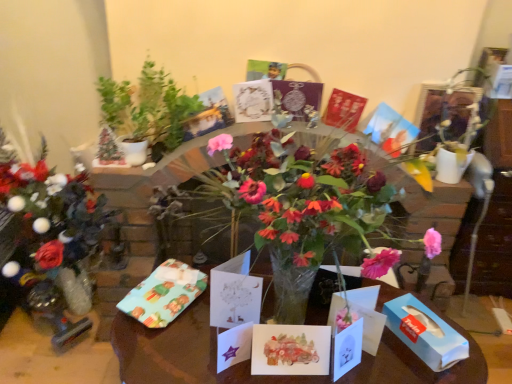
This screenshot has height=384, width=512. I want to click on green leafy plant at upper left, so click(x=148, y=109).

Image resolution: width=512 pixels, height=384 pixels. Describe the element at coordinates (148, 109) in the screenshot. I see `green leafy plant at upper left` at that location.

In order to click on watercolor paper card at center, marked as the 4th birthday card in a back-to-front arrangement in this screenshot , I will do `click(290, 350)`.

What do you see at coordinates (182, 352) in the screenshot?
I see `matte paper cards at center` at bounding box center [182, 352].

Find the location of `blue paper tissue box at lower right`. blue paper tissue box at lower right is located at coordinates (425, 333).

Is white paper card at center, which is the 1th birthday card in front-to-back order, not near matte paper card at center, the 2th birthday card from the back?

No, there isn't a large distance between white paper card at center, which is the 1th birthday card in front-to-back order, and matte paper card at center, the 2th birthday card from the back.

Which is behind, white paper card at center, positioned as the fifth birthday card in back-to-front order, or matte paper card at center, acting as the fourth birthday card starting from the front?

matte paper card at center, acting as the fourth birthday card starting from the front, is more distant.

Can you confirm if white paper card at center, which is the 1th birthday card in front-to-back order, is wider than matte paper card at center, the 3th birthday card when ordered from bottom to top?

In fact, white paper card at center, which is the 1th birthday card in front-to-back order, might be narrower than matte paper card at center, the 3th birthday card when ordered from bottom to top.

How far apart are white paper card at center, which is the 1th birthday card in front-to-back order, and matte paper card at center, the 3th birthday card when ordered from bottom to top?

white paper card at center, which is the 1th birthday card in front-to-back order, and matte paper card at center, the 3th birthday card when ordered from bottom to top, are 21.70 inches apart from each other.

Is blue paper tissue box at lower right to the left or to the right of matte paper card at center, which ranks as the 3th birthday card in top-to-bottom order, in the image?

blue paper tissue box at lower right is positioned on matte paper card at center, which ranks as the 3th birthday card in top-to-bottom order,'s left side.

Could you tell me if blue paper tissue box at lower right is turned towards matte paper card at center, the 2th birthday card from the back?

No, blue paper tissue box at lower right is not turned towards matte paper card at center, the 2th birthday card from the back.

From the image's perspective, which object appears higher, blue paper tissue box at lower right or matte paper card at center, acting as the fourth birthday card starting from the front?

matte paper card at center, acting as the fourth birthday card starting from the front, from the image's perspective.

From a real-world perspective, does blue paper tissue box at lower right sit lower than matte paper card at center, acting as the fourth birthday card starting from the front?

Yes.

Is matte paper cards at center positioned in front of white paper card at center, acting as the first birthday card starting from the top?

Yes, matte paper cards at center is closer to the camera.

Does matte paper cards at center have a smaller size compared to white paper card at center, the third birthday card when ordered from back to front?

Actually, matte paper cards at center might be larger than white paper card at center, the third birthday card when ordered from back to front.

Does point (263, 307) lie in front of point (246, 120)?

Yes, point (263, 307) is closer to viewer.

Considering the sizes of objects matte paper cards at center and white paper card at center, which appears as the 3th birthday card when viewed from the front, in the image provided, who is taller, matte paper cards at center or white paper card at center, which appears as the 3th birthday card when viewed from the front,?

Standing taller between the two is matte paper cards at center.

Looking at the image, does white paper card at center, positioned as the 1th birthday card in bottom-to-top order, seem bigger or smaller compared to green leafy plant at upper left?

In the image, white paper card at center, positioned as the 1th birthday card in bottom-to-top order, appears to be smaller than green leafy plant at upper left.

Which is closer, (351, 348) or (134, 138)?

Point (351, 348) appears to be closer to the viewer than point (134, 138).

From the image's perspective, is white paper card at center, positioned as the fifth birthday card in top-to-bottom order, located above green leafy plant at upper left?

No.

Is white paper card at center, which is the 1th birthday card in front-to-back order, in front of or behind green leafy plant at upper left in the image?

In the image, white paper card at center, which is the 1th birthday card in front-to-back order, appears in front of green leafy plant at upper left.

Is the position of blue paper tissue box at lower right less distant than that of matte paper cards at center?

No.

Considering the sizes of objects blue paper tissue box at lower right and matte paper cards at center in the image provided, who is bigger, blue paper tissue box at lower right or matte paper cards at center?

Bigger between the two is matte paper cards at center.

From the image's perspective, is blue paper tissue box at lower right positioned above or below matte paper cards at center?

blue paper tissue box at lower right is situated higher than matte paper cards at center in the image.

From a real-world perspective, is blue paper tissue box at lower right physically below matte paper cards at center?

Actually, blue paper tissue box at lower right is physically above matte paper cards at center in the real world.

Can you tell me how much green leafy plant at upper left and white paper card at center, acting as the first birthday card starting from the top, differ in facing direction?

The angle between the facing direction of green leafy plant at upper left and the facing direction of white paper card at center, acting as the first birthday card starting from the top, is 7.41 degrees.

From the image's perspective, which is above, green leafy plant at upper left or white paper card at center, the third birthday card when ordered from back to front?

white paper card at center, the third birthday card when ordered from back to front, appears higher in the image.

Is green leafy plant at upper left outside of white paper card at center, placed as the fifth birthday card when sorted from bottom to top?

green leafy plant at upper left is positioned outside white paper card at center, placed as the fifth birthday card when sorted from bottom to top.

From a real-world perspective, is green leafy plant at upper left located higher than white paper card at center, the third birthday card when ordered from back to front?

No, from a real-world perspective, green leafy plant at upper left is not on top of white paper card at center, the third birthday card when ordered from back to front.

Is matte paper card at center, which ranks as the 3th birthday card in top-to-bottom order, positioned far away from matte red card at center, the fifth birthday card viewed from the front?

No, there isn't a large distance between matte paper card at center, which ranks as the 3th birthday card in top-to-bottom order, and matte red card at center, the fifth birthday card viewed from the front.

Considering the positions of point (381, 135) and point (344, 112), is point (381, 135) closer or farther from the camera than point (344, 112)?

Point (381, 135) is positioned closer to the camera compared to point (344, 112).

Does matte paper card at center, acting as the fourth birthday card starting from the front, lie in front of matte red card at center, which is the fourth birthday card from bottom to top?

Yes, matte paper card at center, acting as the fourth birthday card starting from the front, is in front of matte red card at center, which is the fourth birthday card from bottom to top.

Identify the location of the 2nd birthday card below the matte paper card at center, which ranks as the 3th birthday card in top-to-bottom order (from the image's perspective). This screenshot has width=512, height=384. (347, 349).

The height and width of the screenshot is (384, 512). Find the location of `box below the matte paper card at center, acting as the fourth birthday card starting from the front (from a real-world perspective)`. box below the matte paper card at center, acting as the fourth birthday card starting from the front (from a real-world perspective) is located at coordinates (425, 333).

When comparing their distances from matte paper card at center, the 2th birthday card from the back, does white paper card at center, acting as the first birthday card starting from the top, or matte red card at center, which is counted as the 1th birthday card, starting from the back, seem closer?

Based on the image, matte red card at center, which is counted as the 1th birthday card, starting from the back, appears to be nearer to matte paper card at center, the 2th birthday card from the back.

Looking at the image, which one is located closer to green leafy plant at upper left, watercolor paper card at center, positioned as the second birthday card in front-to-back order, or white paper card at center, placed as the fifth birthday card when sorted from bottom to top?

Among the two, white paper card at center, placed as the fifth birthday card when sorted from bottom to top, is located nearer to green leafy plant at upper left.

Considering their positions, is matte paper card at center, which ranks as the 3th birthday card in top-to-bottom order, positioned closer to white paper card at center, positioned as the fifth birthday card in top-to-bottom order, than green leafy plant at upper left?

matte paper card at center, which ranks as the 3th birthday card in top-to-bottom order.

Based on their spatial positions, is blue paper tissue box at lower right or matte paper card at center, acting as the fourth birthday card starting from the front, further from matte red card at center, the second birthday card when ordered from top to bottom?

blue paper tissue box at lower right is further to matte red card at center, the second birthday card when ordered from top to bottom.

When comparing their distances from matte red card at center, which is counted as the 1th birthday card, starting from the back, does watercolor paper card at center, marked as the 4th birthday card in a back-to-front arrangement, or matte paper cards at center seem closer?

matte paper cards at center.

When comparing their distances from green leafy plant at upper left, does matte paper cards at center or watercolor paper card at center, arranged as the 2th birthday card when ordered from the bottom, seem further?

watercolor paper card at center, arranged as the 2th birthday card when ordered from the bottom.

Considering their positions, is matte paper card at center, the 2th birthday card from the back, positioned closer to white paper card at center, which appears as the 3th birthday card when viewed from the front, than blue paper tissue box at lower right?

Based on the image, matte paper card at center, the 2th birthday card from the back, appears to be nearer to white paper card at center, which appears as the 3th birthday card when viewed from the front.

Which object lies nearer to the anchor point watercolor paper card at center, arranged as the 2th birthday card when ordered from the bottom, white paper card at center, the third birthday card when ordered from back to front, or matte paper cards at center?

Among the two, matte paper cards at center is located nearer to watercolor paper card at center, arranged as the 2th birthday card when ordered from the bottom.

The height and width of the screenshot is (384, 512). I want to click on box that lies between matte red card at center, which is counted as the 1th birthday card, starting from the back, and white paper card at center, positioned as the 1th birthday card in bottom-to-top order, from top to bottom, so click(x=425, y=333).

Identify the location of table between watercolor paper card at center, positioned as the second birthday card in front-to-back order, and white paper card at center, positioned as the fifth birthday card in top-to-bottom order. (182, 352).

At what (x,y) coordinates should I click in order to perform the action: click on box between matte red card at center, which is counted as the 1th birthday card, starting from the back, and matte paper cards at center vertically. Please return your answer as a coordinate pair (x, y). The height and width of the screenshot is (384, 512). Looking at the image, I should click on (425, 333).

Identify the location of houseplant between white paper card at center, which appears as the 3th birthday card when viewed from the front, and matte paper cards at center vertically. (148, 109).